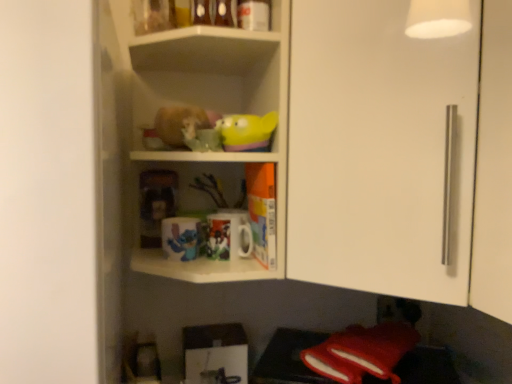
Question: In terms of width, does matte ceramic mug at center, acting as the 2th mug starting from the left, look wider or thinner when compared to fuzzy fabric hamster at center?

Choices:
 (A) thin
 (B) wide

Answer: (A)

Question: Would you say matte ceramic mug at center, acting as the 2th mug starting from the left, is inside or outside fuzzy fabric hamster at center?

Choices:
 (A) outside
 (B) inside

Answer: (A)

Question: Estimate the real-world distances between objects in this image. Which object is closer to the matte plastic toy at center, which is counted as the 2th toy, starting from the top?

Choices:
 (A) white glossy cabinet door at upper right
 (B) rubber duck at upper center, the 2th toy from the back
 (C) fuzzy fabric hamster at center
 (D) glossy ceramic mug at upper center, arranged as the second mug when viewed from the right
 (E) white glossy shelves at upper center

Answer: (D)

Question: Which of these objects is positioned closest to the white glossy cabinet door at upper right?

Choices:
 (A) matte ceramic mug at center, which is the first mug in right-to-left order
 (B) fuzzy fabric hamster at center
 (C) white glossy shelves at upper center
 (D) glossy ceramic mug at upper center, arranged as the second mug when viewed from the right
 (E) rubber duck at upper center, the second toy from the left

Answer: (C)